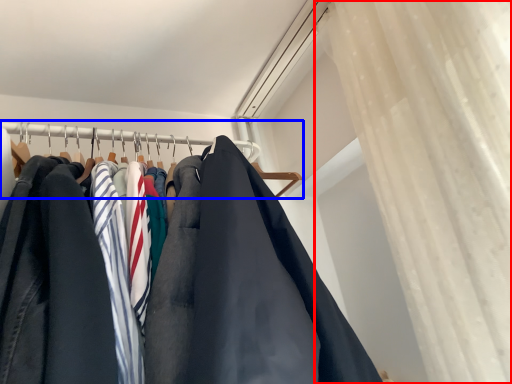
Question: Which point is further to the camera, curtain (highlighted by a red box) or closet (highlighted by a blue box)?

Choices:
 (A) curtain
 (B) closet

Answer: (B)